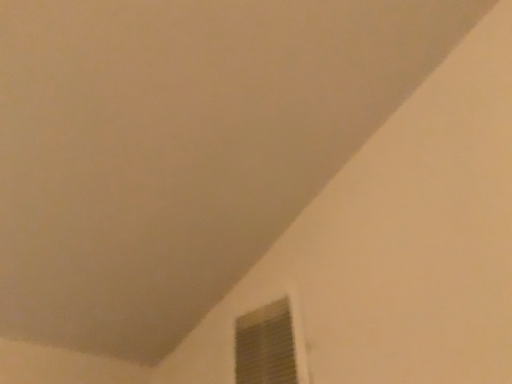
You are a GUI agent. You are given a task and a screenshot of the screen. Output one action in this format:
    pyautogui.click(x=<x>, y=<y>)
    Task: Click on the wooden slats window at lower right
    The image size is (512, 384).
    Given the screenshot: What is the action you would take?
    pyautogui.click(x=266, y=346)

What do you see at coordinates (266, 346) in the screenshot? I see `wooden slats window at lower right` at bounding box center [266, 346].

Where is `wooden slats window at lower right`? wooden slats window at lower right is located at coordinates tap(266, 346).